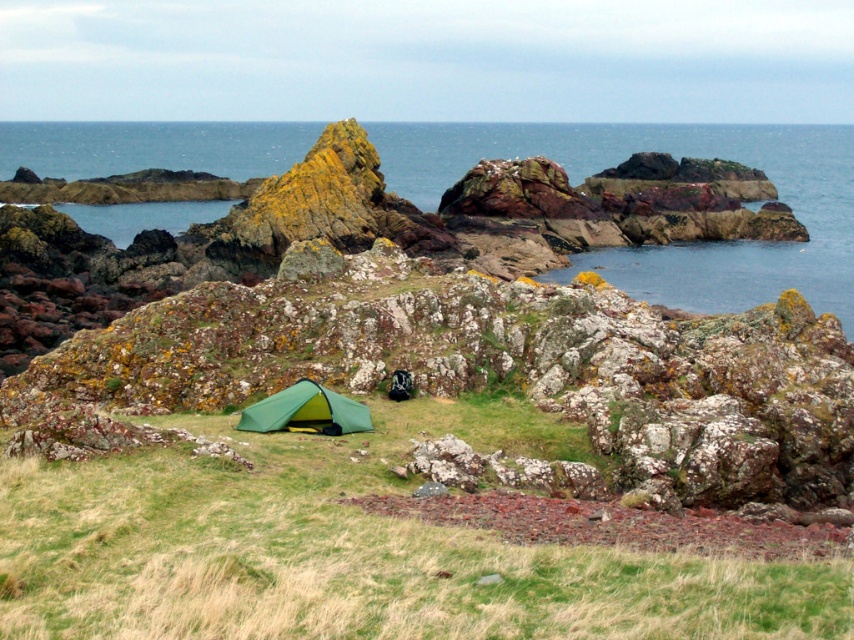
Measure the distance between green grassy at center and green fabric tent at center.

They are 8.65 feet apart.

Consider the image. Does green grassy at center appear on the left side of green fabric tent at center?

Incorrect, green grassy at center is not on the left side of green fabric tent at center.

Describe the element at coordinates (354, 548) in the screenshot. I see `green grassy at center` at that location.

Find the location of `green grassy at center`. green grassy at center is located at coordinates (354, 548).